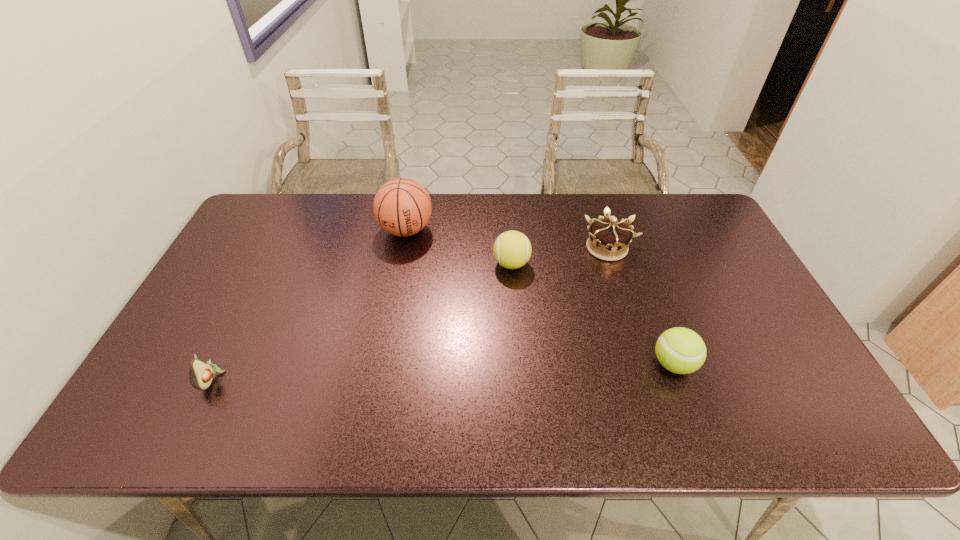
Find the location of a particular element. vacant area between the second object from left to right and the leftmost object is located at coordinates (309, 305).

Where is `free space that is in between the nearer tennis ball and the tallest object`? The height and width of the screenshot is (540, 960). free space that is in between the nearer tennis ball and the tallest object is located at coordinates (540, 297).

Where is `vacant space that's between the third object from right to left and the avocado`? The image size is (960, 540). vacant space that's between the third object from right to left and the avocado is located at coordinates (362, 321).

Locate an element on the screen. This screenshot has width=960, height=540. vacant point located between the crown and the leftmost object is located at coordinates (409, 313).

Where is `vacant space in between the right tennis ball and the crown`? Image resolution: width=960 pixels, height=540 pixels. vacant space in between the right tennis ball and the crown is located at coordinates (640, 306).

Where is `free point between the nearer tennis ball and the crown`? The image size is (960, 540). free point between the nearer tennis ball and the crown is located at coordinates (640, 306).

Image resolution: width=960 pixels, height=540 pixels. Identify the location of vacant area that lies between the farther tennis ball and the fourth object from right to left. (459, 247).

In order to click on vacant area that lies between the third object from right to left and the right tennis ball in this screenshot , I will do click(x=592, y=314).

I want to click on free space between the third object from right to left and the nearer tennis ball, so click(x=592, y=314).

Identify which object is located as the fourth nearest to the nearer tennis ball. Please provide its 2D coordinates. Your answer should be formatted as a tuple, i.e. [(x, y)], where the tuple contains the x and y coordinates of a point satisfying the conditions above.

[(201, 374)]